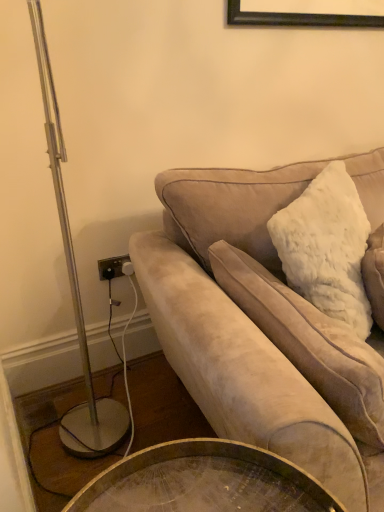
In order to face white fluffy pillow at upper right, should I rotate leftwards or rightwards?

You should look right and rotate roughly 15.917 degrees.

What do you see at coordinates (309, 341) in the screenshot? The image size is (384, 512). I see `white fluffy pillow at upper right` at bounding box center [309, 341].

What is the approximate height of white fluffy pillow at upper right?

43.35 centimeters.

In order to click on white fluffy pillow at upper right in this screenshot , I will do `click(309, 341)`.

The width and height of the screenshot is (384, 512). What do you see at coordinates (259, 330) in the screenshot? I see `suede couch at right` at bounding box center [259, 330].

Find the location of a particular element. suede couch at right is located at coordinates (259, 330).

What is the approximate width of suede couch at right?

It is 1.10 meters.

You are a GUI agent. You are given a task and a screenshot of the screen. Output one action in this format:
    pyautogui.click(x=<x>, y=<y>)
    Task: Click on the white fluffy pillow at upper right
    This screenshot has width=384, height=512.
    Given the screenshot: What is the action you would take?
    pyautogui.click(x=309, y=341)

Between white fluffy pillow at upper right and suede couch at right, which one appears on the right side from the viewer's perspective?

From the viewer's perspective, suede couch at right appears more on the right side.

Which object is further away from the camera taking this photo, white fluffy pillow at upper right or suede couch at right?

white fluffy pillow at upper right.

Is point (231, 298) positioned in front of point (197, 178)?

Yes, it is in front of point (197, 178).

From the image's perspective, is white fluffy pillow at upper right positioned above or below suede couch at right?

Based on their image positions, white fluffy pillow at upper right is located beneath suede couch at right.

From a real-world perspective, is white fluffy pillow at upper right above or below suede couch at right?

In terms of real-world spatial position, white fluffy pillow at upper right is above suede couch at right.

Between white fluffy pillow at upper right and suede couch at right, which one has larger width?

suede couch at right.

Who is shorter, white fluffy pillow at upper right or suede couch at right?

Standing shorter between the two is white fluffy pillow at upper right.

Considering the relative sizes of white fluffy pillow at upper right and suede couch at right in the image provided, is white fluffy pillow at upper right bigger than suede couch at right?

Incorrect, white fluffy pillow at upper right is not larger than suede couch at right.

Is white fluffy pillow at upper right outside of suede couch at right?

No, white fluffy pillow at upper right is not outside of suede couch at right.

In the scene shown: Is white fluffy pillow at upper right next to suede couch at right?

white fluffy pillow at upper right is not next to suede couch at right, and they're not touching.

Is white fluffy pillow at upper right looking in the opposite direction of suede couch at right?

Yes, white fluffy pillow at upper right is facing away from suede couch at right.

Image resolution: width=384 pixels, height=512 pixels. What are the coordinates of `pillow below the suede couch at right (from the image's perspective)` in the screenshot? It's located at (309, 341).

Based on their positions, is suede couch at right located to the left or right of white fluffy pillow at upper right?

Clearly, suede couch at right is on the right of white fluffy pillow at upper right in the image.

Considering the positions of objects suede couch at right and white fluffy pillow at upper right in the image provided, who is behind, suede couch at right or white fluffy pillow at upper right?

white fluffy pillow at upper right is more distant.

Which is closer to the camera, [320,406] or [265,288]?

Point [320,406].

From the image's perspective, is suede couch at right over white fluffy pillow at upper right?

Yes, from the image's perspective, suede couch at right is on top of white fluffy pillow at upper right.

From a real-world perspective, does suede couch at right sit lower than white fluffy pillow at upper right?

Yes, from a real-world perspective, suede couch at right is beneath white fluffy pillow at upper right.

Considering the sizes of suede couch at right and white fluffy pillow at upper right in the image, is suede couch at right wider or thinner than white fluffy pillow at upper right?

suede couch at right is wider than white fluffy pillow at upper right.

Does suede couch at right have a lesser height compared to white fluffy pillow at upper right?

No.

Based on the photo, based on their sizes in the image, would you say suede couch at right is bigger or smaller than white fluffy pillow at upper right?

suede couch at right is bigger than white fluffy pillow at upper right.

Is suede couch at right surrounding white fluffy pillow at upper right?

Yes, suede couch at right contains white fluffy pillow at upper right.

Is the surface of suede couch at right in direct contact with white fluffy pillow at upper right?

No, suede couch at right is not touching white fluffy pillow at upper right.

Could you tell me if suede couch at right is turned towards white fluffy pillow at upper right?

Yes, suede couch at right faces towards white fluffy pillow at upper right.

How distant is suede couch at right from white fluffy pillow at upper right?

suede couch at right is 10.32 centimeters away from white fluffy pillow at upper right.

Where is `pillow below the suede couch at right (from the image's perspective)`? This screenshot has width=384, height=512. pillow below the suede couch at right (from the image's perspective) is located at coordinates pos(309,341).

Where is `pillow below the suede couch at right (from the image's perspective)`? The width and height of the screenshot is (384, 512). pillow below the suede couch at right (from the image's perspective) is located at coordinates (309, 341).

The width and height of the screenshot is (384, 512). What are the coordinates of `pillow behind the suede couch at right` in the screenshot? It's located at (309, 341).